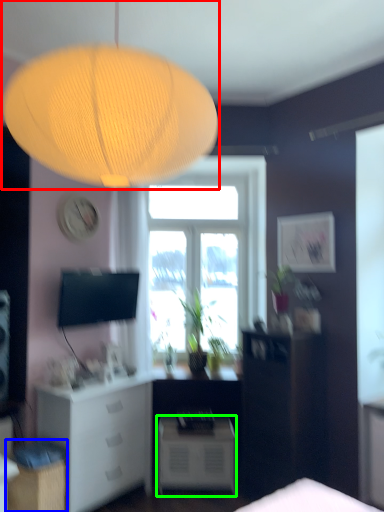
Question: Based on their relative distances, which object is farther from lamp (highlighted by a red box)? Choose from cabinetry (highlighted by a blue box) and nightstand (highlighted by a green box).

Choices:
 (A) cabinetry
 (B) nightstand

Answer: (B)